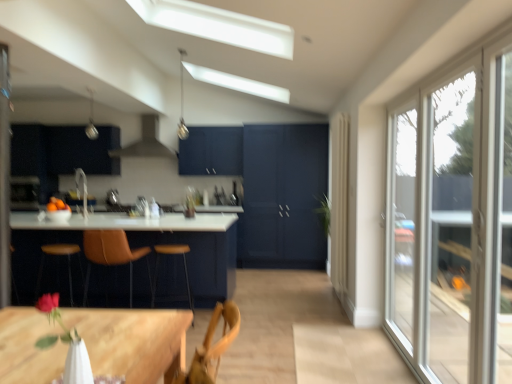
Question: From a real-world perspective, relative to wooden table at lower left, the 2th table when ordered from front to back, is metallic pendant light at upper center, arranged as the first light fixture when viewed from the right, vertically above or below?

Choices:
 (A) above
 (B) below

Answer: (A)

Question: Is metallic pendant light at upper center, arranged as the first light fixture when viewed from the right, to the left or to the right of wooden table at lower left, the second table from the right, in the image?

Choices:
 (A) left
 (B) right

Answer: (B)

Question: Estimate the real-world distances between objects in this image. Which object is closer to the metallic pendant light at upper center, arranged as the first light fixture when viewed from the right?

Choices:
 (A) brown leather chair at center
 (B) matte black cabinet at upper left
 (C) brown leather bar stool at center, marked as the second bar stool in a left-to-right arrangement
 (D) clear glass window at right
 (E) wooden table at lower left, the first table when ordered from right to left

Answer: (B)

Question: Estimate the real-world distances between objects in this image. Which object is farther from the brown leather bar stool at center, marked as the second bar stool in a left-to-right arrangement?

Choices:
 (A) brown leather bar stool at left, arranged as the 1th bar stool when viewed from the left
 (B) brown leather chair at center
 (C) matte dark blue cabinet at center
 (D) orange matte bowl at left
 (E) matte black cabinet at upper left

Answer: (C)